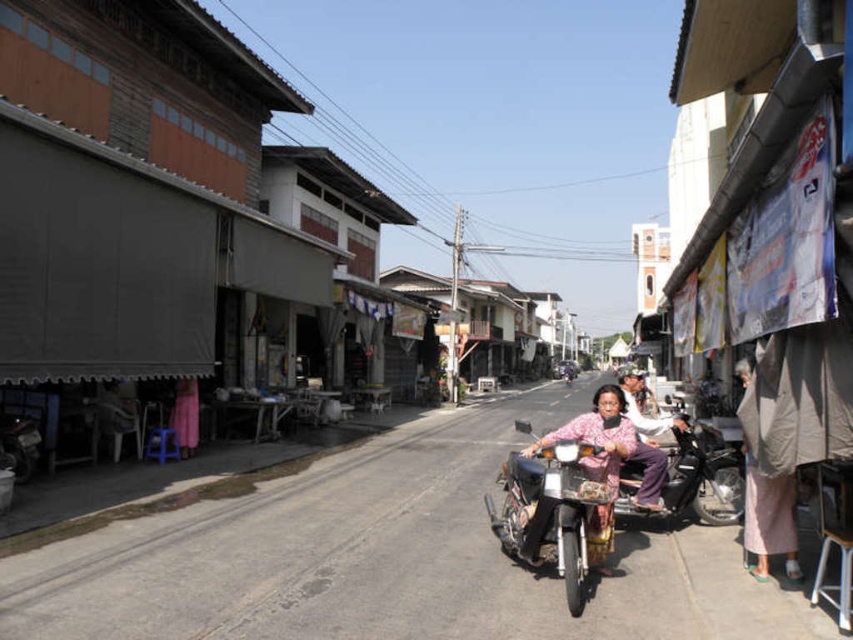
You are a delivery rider who needs to park your motorcycle in a spot that is exactly 5 meters away from another motorcycle. Given the scene, can you find a suitable parking spot between the matte black motorcycle at center and the metallic silver motorcycle at center?

Yes, the distance between the matte black motorcycle at center and the metallic silver motorcycle at center is 5.03 meters, which is very close to the required 5 meters. Therefore, you can park your motorcycle in this spot between them.

You are a delivery person who needs to park your matte black motorcycle at center between two parked cars. The space between the cars is exactly the width of the matte pink pants at center. Will your motorcycle fit?

The matte black motorcycle at center is narrower than the matte pink pants at center, so it will fit in the space between the cars.

You are standing at the point marked by the coordinates point (563,499), which is the location of a metallic silver motorcycle at center. You want to walk to the nearest building on the left side of the street. Which direction should you head towards?

The metallic silver motorcycle at center is located at point (563,499). To reach the nearest building on the left side of the street, you should head towards the left side of the street where the buildings are situated.